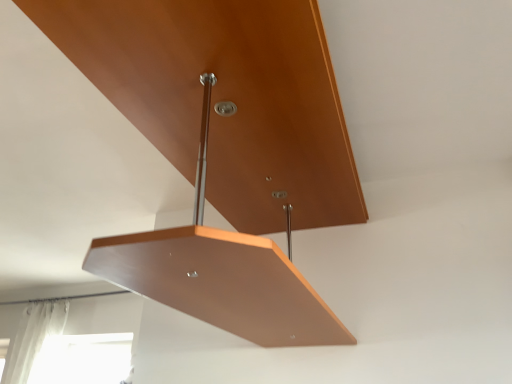
Question: Should I look upward or downward to see matte wood shelf at center?

Choices:
 (A) down
 (B) up

Answer: (A)

Question: From a real-world perspective, is white sheer curtain at lower left located beneath matte wood shelf at center?

Choices:
 (A) no
 (B) yes

Answer: (B)

Question: Does white sheer curtain at lower left have a smaller size compared to matte wood shelf at center?

Choices:
 (A) yes
 (B) no

Answer: (A)

Question: Does white sheer curtain at lower left have a lesser width compared to matte wood shelf at center?

Choices:
 (A) no
 (B) yes

Answer: (B)

Question: Is white sheer curtain at lower left positioned beyond the bounds of matte wood shelf at center?

Choices:
 (A) yes
 (B) no

Answer: (A)

Question: From the image's perspective, would you say white sheer curtain at lower left is shown under matte wood shelf at center?

Choices:
 (A) yes
 (B) no

Answer: (A)

Question: Can you confirm if white sheer curtain at lower left is bigger than matte wood shelf at center?

Choices:
 (A) no
 (B) yes

Answer: (A)

Question: From the image's perspective, is matte wood shelf at center under white sheer curtain at lower left?

Choices:
 (A) no
 (B) yes

Answer: (A)

Question: Is matte wood shelf at center thinner than white sheer curtain at lower left?

Choices:
 (A) yes
 (B) no

Answer: (B)

Question: Is matte wood shelf at center next to white sheer curtain at lower left?

Choices:
 (A) yes
 (B) no

Answer: (B)

Question: From a real-world perspective, is matte wood shelf at center beneath white sheer curtain at lower left?

Choices:
 (A) no
 (B) yes

Answer: (A)

Question: Considering the relative sizes of matte wood shelf at center and white sheer curtain at lower left in the image provided, is matte wood shelf at center bigger than white sheer curtain at lower left?

Choices:
 (A) no
 (B) yes

Answer: (B)

Question: Is matte wood shelf at center looking in the opposite direction of white sheer curtain at lower left?

Choices:
 (A) no
 (B) yes

Answer: (B)

Question: Would you say white sheer curtain at lower left is inside or outside matte wood shelf at center?

Choices:
 (A) outside
 (B) inside

Answer: (A)